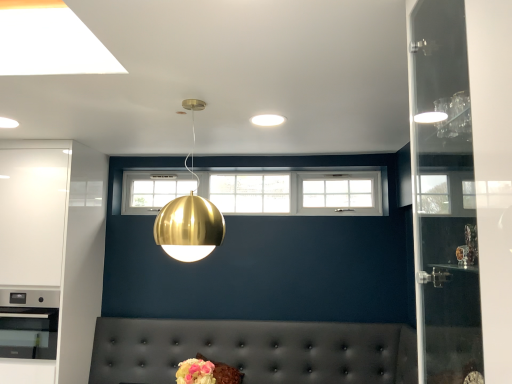
This screenshot has height=384, width=512. What do you see at coordinates (53, 249) in the screenshot?
I see `white glossy cabinet at left` at bounding box center [53, 249].

What is the approximate height of white glossy cabinet at left?

white glossy cabinet at left is 6.14 feet in height.

Measure the distance between white matte light fixture at center and camera.

white matte light fixture at center and camera are 7.62 feet apart from each other.

Locate an element on the screen. Image resolution: width=512 pixels, height=384 pixels. tufted leather couch at lower center is located at coordinates (254, 350).

Is the position of tufted leather couch at lower center more distant than that of white glossy cabinet at left?

That is False.

Which object is wider, tufted leather couch at lower center or white glossy cabinet at left?

tufted leather couch at lower center is wider.

Considering the relative positions of tufted leather couch at lower center and white glossy cabinet at left in the image provided, is tufted leather couch at lower center to the right of white glossy cabinet at left from the viewer's perspective?

Yes.

Based on the photo, would you consider tufted leather couch at lower center to be distant from white glossy cabinet at left?

That's not correct — tufted leather couch at lower center is a little close to white glossy cabinet at left.

Which is in front, white glossy cabinet at left or tufted leather couch at lower center?

tufted leather couch at lower center is in front.

Is white glossy cabinet at left at the left side of tufted leather couch at lower center?

Answer: Indeed, white glossy cabinet at left is positioned on the left side of tufted leather couch at lower center.

Is white glossy cabinet at left taller than tufted leather couch at lower center?

Yes, white glossy cabinet at left is taller than tufted leather couch at lower center.

From a real-world perspective, between tufted leather couch at lower center and white matte light fixture at center, who is vertically higher?

white matte light fixture at center, from a real-world perspective.

Is tufted leather couch at lower center not inside white matte light fixture at center?

Yes, tufted leather couch at lower center is outside of white matte light fixture at center.

How many degrees apart are the facing directions of tufted leather couch at lower center and white matte light fixture at center?

The angular difference between tufted leather couch at lower center and white matte light fixture at center is 87.4 degrees.

Is tufted leather couch at lower center not near white matte light fixture at center?

Yes, tufted leather couch at lower center and white matte light fixture at center are located far from each other.

Which is more to the right, gold metallic sphere at center or tufted leather couch at lower center?

gold metallic sphere at center.

Considering the sizes of gold metallic sphere at center and tufted leather couch at lower center in the image, is gold metallic sphere at center bigger or smaller than tufted leather couch at lower center?

In the image, gold metallic sphere at center appears to be smaller than tufted leather couch at lower center.

Consider the image. How far apart are gold metallic sphere at center and tufted leather couch at lower center?

gold metallic sphere at center is 5.09 feet from tufted leather couch at lower center.

From the image's perspective, which one is positioned higher, gold metallic sphere at center or tufted leather couch at lower center?

From the image's view, gold metallic sphere at center is above.

From a real-world perspective, is gold metallic sphere at center positioned under white matte light fixture at center based on gravity?

Correct, in the physical world, gold metallic sphere at center is lower than white matte light fixture at center.

Which point is more distant from viewer, (x=209, y=219) or (x=263, y=115)?

The point (x=263, y=115) is farther from the camera.

Looking at their sizes, would you say gold metallic sphere at center is wider or thinner than white matte light fixture at center?

gold metallic sphere at center is wider than white matte light fixture at center.

Looking at the image, does gold metallic sphere at center seem bigger or smaller compared to white matte light fixture at center?

Clearly, gold metallic sphere at center is larger in size than white matte light fixture at center.

Is white matte light fixture at center at the left side of gold metallic sphere at center?

No, white matte light fixture at center is not to the left of gold metallic sphere at center.

How different are the orientations of white matte light fixture at center and gold metallic sphere at center in degrees?

They differ by 90 degrees in their facing directions.

From the image's perspective, which object appears higher, white matte light fixture at center or gold metallic sphere at center?

white matte light fixture at center, from the image's perspective.

Does white matte light fixture at center have a lesser width compared to gold metallic sphere at center?

Yes, white matte light fixture at center is thinner than gold metallic sphere at center.

Does white glossy cabinet at left have a lesser height compared to gold metallic sphere at center?

No, white glossy cabinet at left is not shorter than gold metallic sphere at center.

Based on the photo, is white glossy cabinet at left closer to the viewer compared to gold metallic sphere at center?

No.

Which point is more forward, (36, 197) or (208, 226)?

Positioned in front is point (208, 226).

In the scene shown: Is white glossy cabinet at left looking in the opposite direction of gold metallic sphere at center?

No.

Where is `couch below the white glossy cabinet at left (from the image's perspective)`? The width and height of the screenshot is (512, 384). couch below the white glossy cabinet at left (from the image's perspective) is located at coordinates (254, 350).

Where is `couch located on the right of white glossy cabinet at left`? This screenshot has height=384, width=512. couch located on the right of white glossy cabinet at left is located at coordinates (254, 350).

Looking at the image, which one is located closer to gold metallic sphere at center, white matte light fixture at center or white glossy cabinet at left?

The object closer to gold metallic sphere at center is white matte light fixture at center.

Considering their positions, is tufted leather couch at lower center positioned further to white matte light fixture at center than gold metallic sphere at center?

Based on the image, tufted leather couch at lower center appears to be further to white matte light fixture at center.

Estimate the real-world distances between objects in this image. Which object is further from white glossy cabinet at left, tufted leather couch at lower center or white matte light fixture at center?

white matte light fixture at center is positioned further to the anchor white glossy cabinet at left.

Based on their spatial positions, is gold metallic sphere at center or white glossy cabinet at left closer to white matte light fixture at center?

gold metallic sphere at center.

Estimate the real-world distances between objects in this image. Which object is closer to white glossy cabinet at left, tufted leather couch at lower center or gold metallic sphere at center?

tufted leather couch at lower center.

From the picture: Looking at the image, which one is located further to tufted leather couch at lower center, white glossy cabinet at left or gold metallic sphere at center?

Among the two, gold metallic sphere at center is located further to tufted leather couch at lower center.

Considering their positions, is white glossy cabinet at left positioned further to white matte light fixture at center than tufted leather couch at lower center?

Based on the image, tufted leather couch at lower center appears to be further to white matte light fixture at center.

Looking at the image, which one is located closer to white glossy cabinet at left, white matte light fixture at center or gold metallic sphere at center?

The object closer to white glossy cabinet at left is gold metallic sphere at center.

The height and width of the screenshot is (384, 512). In order to click on couch between white glossy cabinet at left and white matte light fixture at center in this screenshot , I will do `click(254, 350)`.

Locate an element on the screen. lamp between white glossy cabinet at left and white matte light fixture at center in the horizontal direction is located at coordinates (189, 228).

Find the location of a particular element. couch between white glossy cabinet at left and gold metallic sphere at center is located at coordinates 254,350.

You are a GUI agent. You are given a task and a screenshot of the screen. Output one action in this format:
    pyautogui.click(x=<x>, y=<y>)
    Task: Click on the lamp between white matte light fixture at center and tufted leather couch at lower center in the vertical direction
    This screenshot has height=384, width=512.
    Given the screenshot: What is the action you would take?
    pyautogui.click(x=189, y=228)